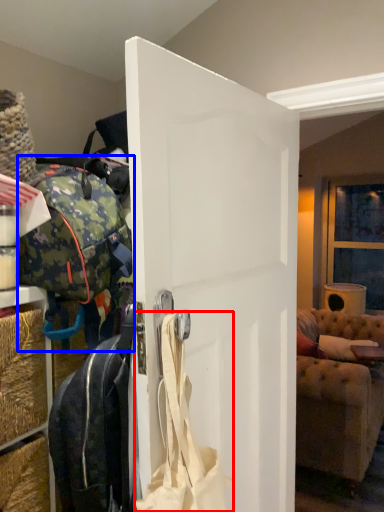
Question: Among these objects, which one is farthest to the camera, shoulder bag (highlighted by a red box) or luggage and bags (highlighted by a blue box)?

Choices:
 (A) shoulder bag
 (B) luggage and bags

Answer: (B)